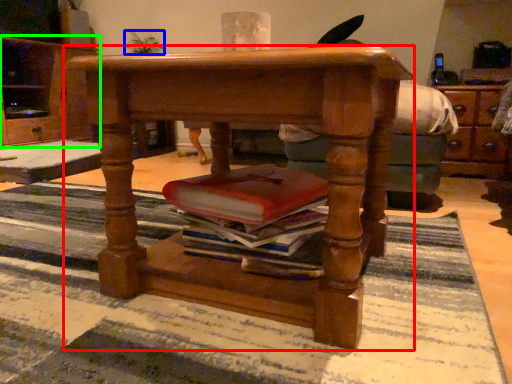
Question: Based on their relative distances, which object is nearer to desk (highlighted by a red box)? Choose from houseplant (highlighted by a blue box) and cabinetry (highlighted by a green box).

Choices:
 (A) houseplant
 (B) cabinetry

Answer: (B)